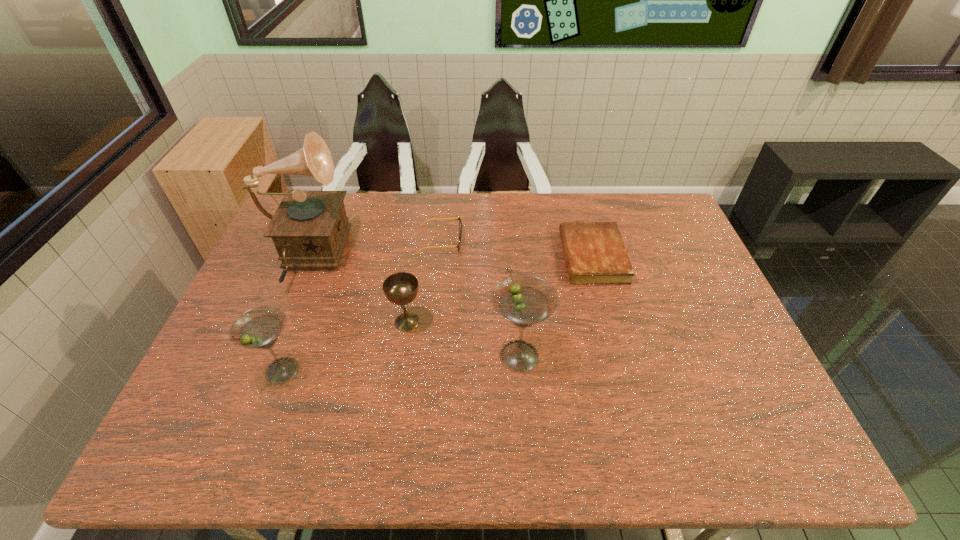
Please show where to add a martini on the right while keeping spacing even. Please provide its 2D coordinates. Your answer should be formatted as a tuple, i.e. [(x, y)], where the tuple contains the x and y coordinates of a point satisfying the conditions above.

[(743, 342)]